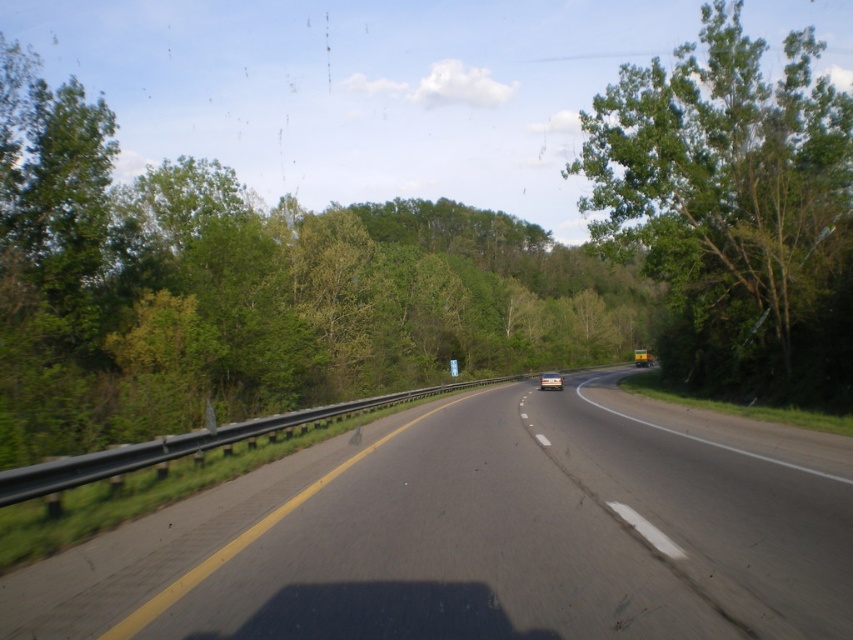
Which is behind, point (831, 115) or point (549, 378)?

The point (549, 378) is behind.

Is point (590, 161) behind point (556, 385)?

No, (590, 161) is in front of (556, 385).

Find the location of a particular element. The height and width of the screenshot is (640, 853). green leafy tree at right is located at coordinates (733, 209).

Is black asphalt highway at center bigger than silver metallic car at center?

No, black asphalt highway at center is not bigger than silver metallic car at center.

Is point (25, 612) closer to viewer compared to point (541, 380)?

Yes, point (25, 612) is in front of point (541, 380).

Where is `black asphalt highway at center`? This screenshot has height=640, width=853. black asphalt highway at center is located at coordinates (482, 536).

Which is more to the left, green leafy tree at center or green leafy tree at right?

green leafy tree at center is more to the left.

In order to click on green leafy tree at center in this screenshot , I will do `click(250, 289)`.